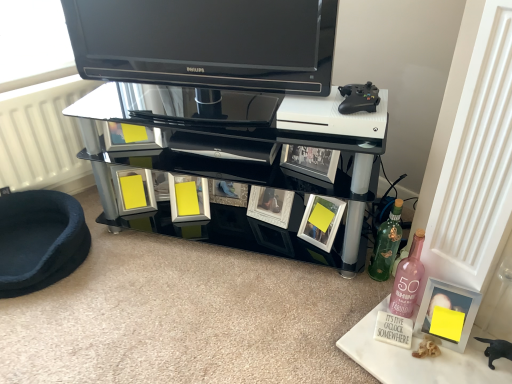
Image resolution: width=512 pixels, height=384 pixels. I want to click on empty space that is in between white glossy picture frame at lower center, acting as the first picture frame starting from the back, and dark blue plush pet bed at lower left, so click(163, 262).